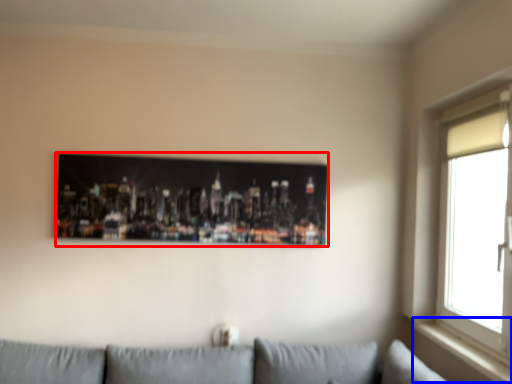
Question: Among these objects, which one is farthest to the camera, picture frame (highlighted by a red box) or window sill (highlighted by a blue box)?

Choices:
 (A) picture frame
 (B) window sill

Answer: (A)